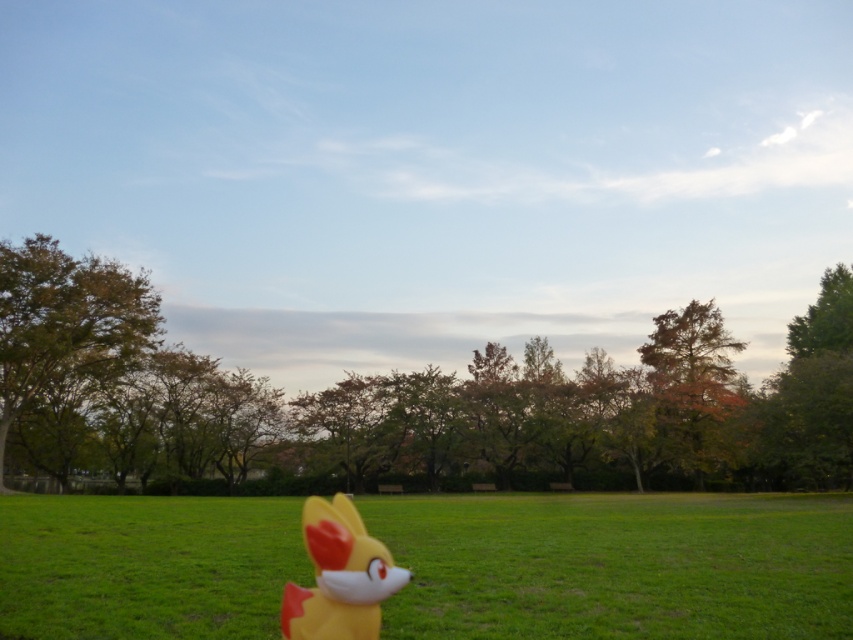
You are a park visitor holding a 2 meter wide kite. You want to fly it between the brown textured tree at left and the autumn leaves at right. Can you fit the kite between them without touching either object?

The distance between the brown textured tree at left and the autumn leaves at right is 38.75 meters. Since the kite is only 2 meters wide, there is more than enough space to fly it between them without touching either object.

You are a child trying to decide whether the brown textured tree at left can block the yellow matte plush toy at lower center from view. Based on their positions and sizes, is it possible that the tree could completely hide the toy from your current viewpoint?

The brown textured tree at left might be wider than yellow matte plush toy at lower center, so there is a possibility that the tree could block the toy from view depending on their exact positions and angles.

You are a park visitor who wants to take a photo of both the green leafy tree at center and the brown textured tree at left. Which tree should you stand closer to in order to capture both in the same frame?

You should stand closer to the brown textured tree at left because the green leafy tree at center is wider than the brown textured tree at left, so moving closer to the narrower tree allows both to fit within the camera frame.